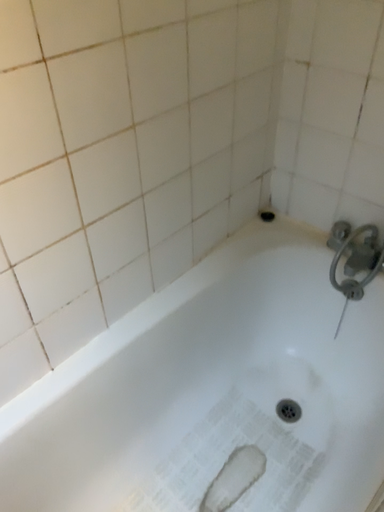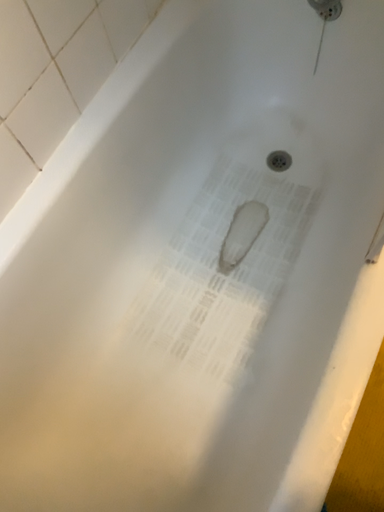
Question: How did the camera likely rotate when shooting the video?

Choices:
 (A) rotated downward
 (B) rotated upward

Answer: (A)